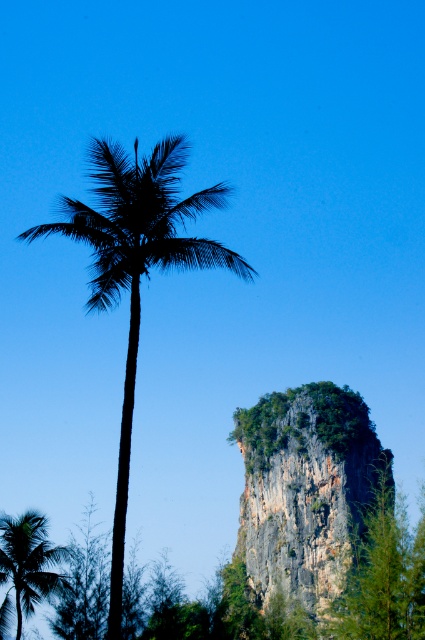
Question: Can you confirm if rocky cliff at center is positioned above green leafy palm at lower left?

Choices:
 (A) yes
 (B) no

Answer: (B)

Question: Can you confirm if rocky cliff at center is positioned to the left of black leafy palm at center?

Choices:
 (A) yes
 (B) no

Answer: (B)

Question: Which of the following is the farthest from the observer?

Choices:
 (A) (53, 556)
 (B) (269, 525)

Answer: (B)

Question: Which of the following is the closest to the observer?

Choices:
 (A) click(x=240, y=266)
 (B) click(x=278, y=509)

Answer: (A)

Question: Does rocky cliff at center have a lesser width compared to black leafy palm at center?

Choices:
 (A) yes
 (B) no

Answer: (A)

Question: Which object is closer to the camera taking this photo?

Choices:
 (A) rocky cliff at center
 (B) green leafy palm at lower left
 (C) black leafy palm at center

Answer: (C)